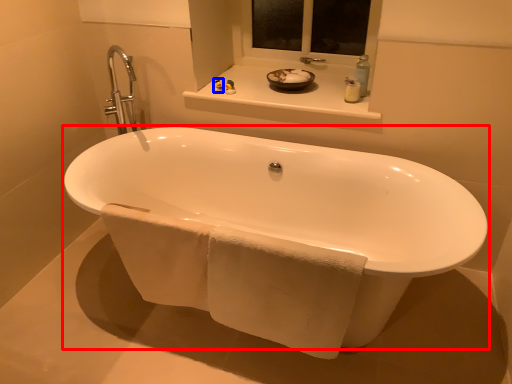
Question: Which of the following is the farthest to the observer, bathtub (highlighted by a red box) or toiletry (highlighted by a blue box)?

Choices:
 (A) bathtub
 (B) toiletry

Answer: (B)